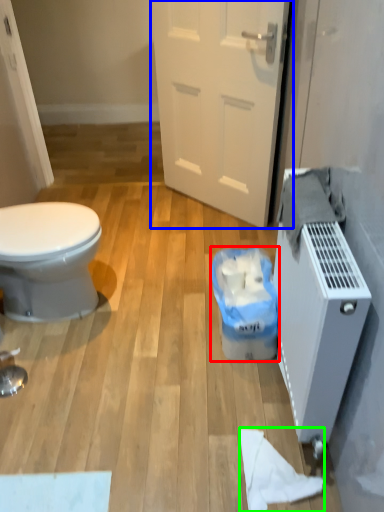
Question: Which is farther away from garbage (highlighted by a red box)? door (highlighted by a blue box) or toilet paper (highlighted by a green box)?

Choices:
 (A) door
 (B) toilet paper

Answer: (A)